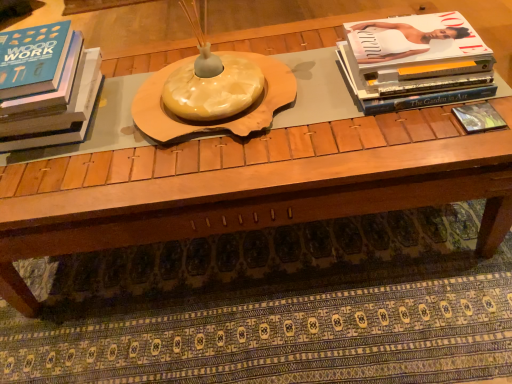
The height and width of the screenshot is (384, 512). I want to click on unoccupied region to the right of matte black book at left, which appears as the third book when viewed from the right, so click(x=132, y=104).